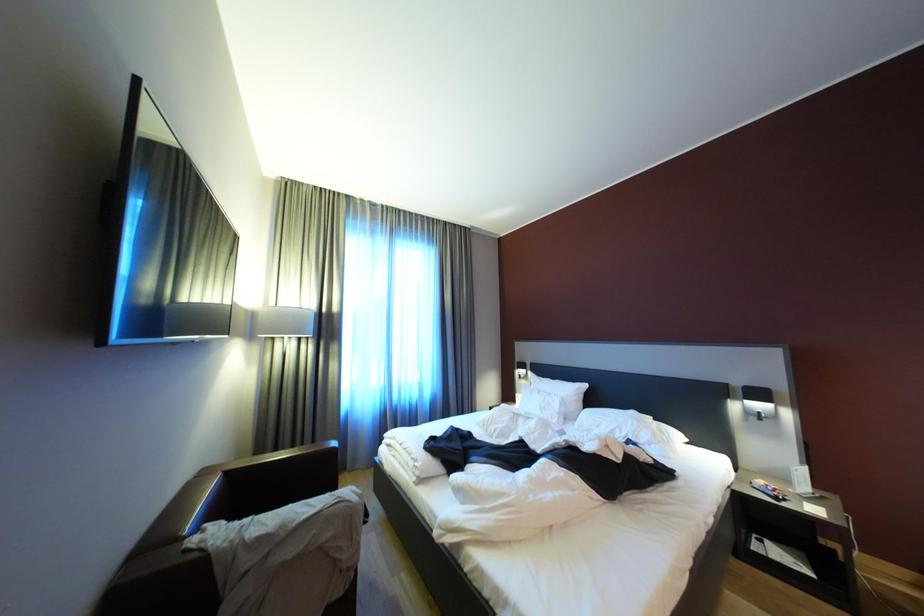
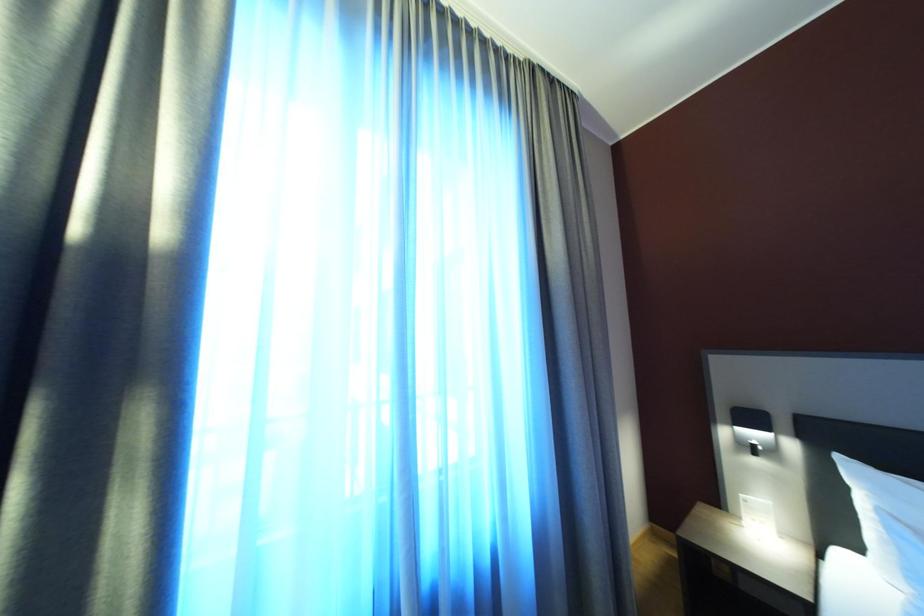
Question: The images are taken continuously from a first-person perspective. In which direction are you moving?

Choices:
 (A) Left
 (B) Right
 (C) Forward
 (D) Backward

Answer: (C)